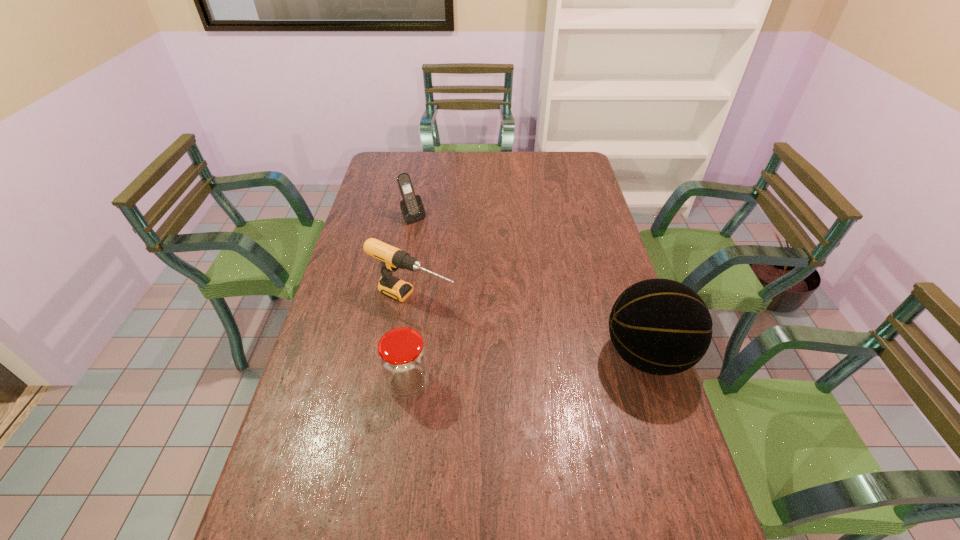
At what (x,y) coordinates should I click in order to perform the action: click on free space at the far right corner of the desktop. Please return your answer as a coordinate pair (x, y). Looking at the image, I should click on (552, 158).

The width and height of the screenshot is (960, 540). I want to click on empty space between the cellular telephone and the jar, so click(x=411, y=300).

Locate an element on the screen. empty space between the cellular telephone and the tallest object is located at coordinates click(530, 286).

Locate an element on the screen. vacant area between the farthest object and the jar is located at coordinates (411, 300).

The image size is (960, 540). What are the coordinates of `free spot between the rightmost object and the farthest object` in the screenshot? It's located at (530, 286).

Locate an element on the screen. vacant area between the cellular telephone and the jar is located at coordinates (411, 300).

Where is `free spot between the farthest object and the jar`? free spot between the farthest object and the jar is located at coordinates (411, 300).

The height and width of the screenshot is (540, 960). In order to click on free space between the jar and the farthest object in this screenshot , I will do `click(411, 300)`.

Locate an element on the screen. Image resolution: width=960 pixels, height=540 pixels. object that can be found as the third closest to the jar is located at coordinates (411, 206).

I want to click on object that stands as the second closest to the basketball, so click(402, 356).